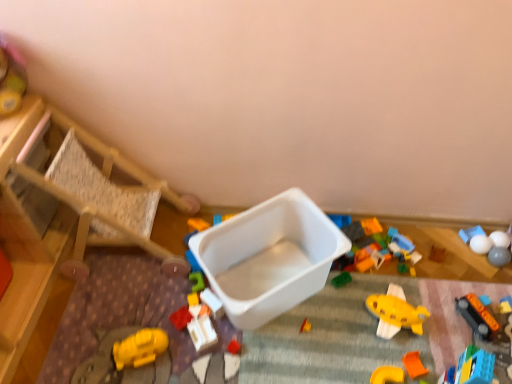
At what (x,y) coordinates should I click in order to perform the action: click on free space behind white plastic container at center, which is counted as the 12th toy, starting from the right. Please return your answer as a coordinate pair (x, y). The height and width of the screenshot is (384, 512). Looking at the image, I should click on (217, 282).